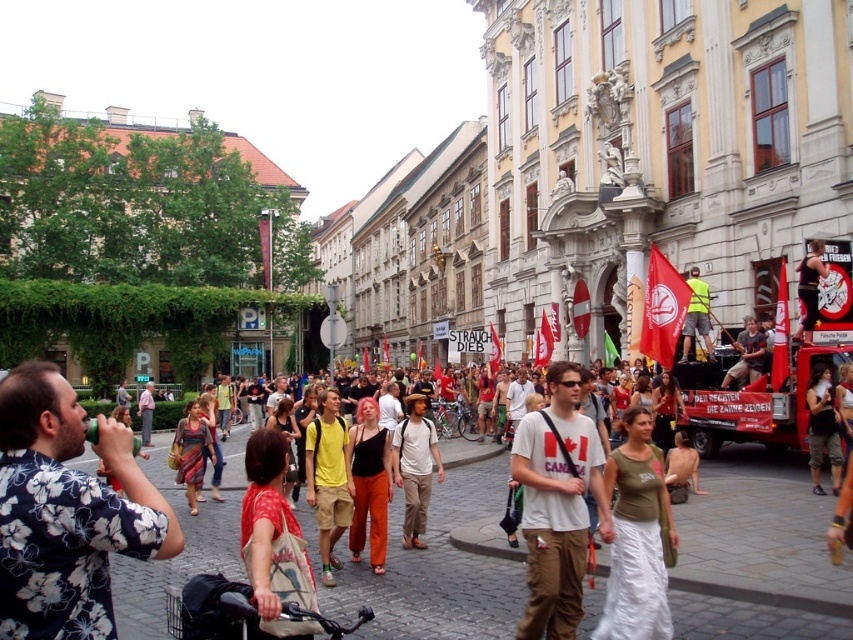
You are standing at the entrance of the street and want to take a photo of both the matte black tank top at center and the multicolored woven dress at center in the same frame. Given that your camera has a maximum zoom range of 10 meters, can you capture both subjects in a single shot without moving?

The matte black tank top at center is 15.28 meters away from the multicolored woven dress at center. Since your camera can only zoom up to 10 meters, it won cannot capture both subjects in a single frame without moving.

You are a photographer standing on the street and want to take a photo of both the printed fabric bag at center and the white cotton shirt at center. Which object should you focus on first to ensure both are in sharp focus?

You should focus on the printed fabric bag at center first since it is closer to the viewer than the white cotton shirt at center, ensuring both will be in focus when using a shallow depth of field.